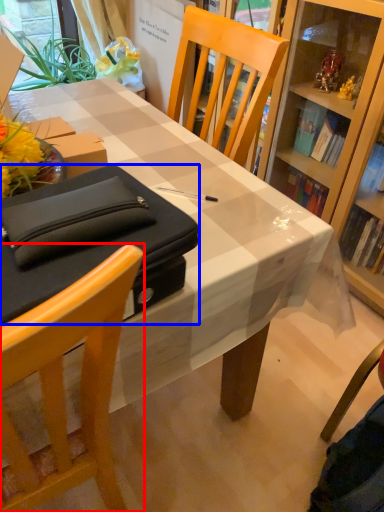
Question: Which object is further to the camera taking this photo, chair (highlighted by a red box) or box (highlighted by a blue box)?

Choices:
 (A) chair
 (B) box

Answer: (B)